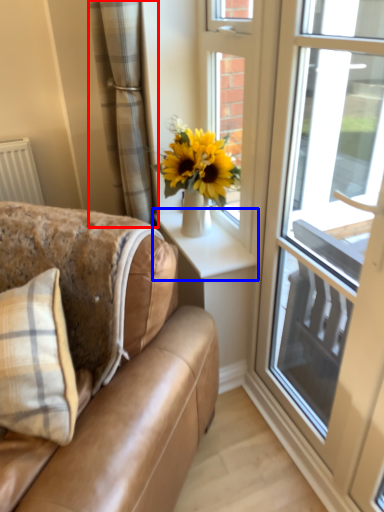
Question: Which object is closer to the camera taking this photo, curtain (highlighted by a red box) or window sill (highlighted by a blue box)?

Choices:
 (A) curtain
 (B) window sill

Answer: (A)